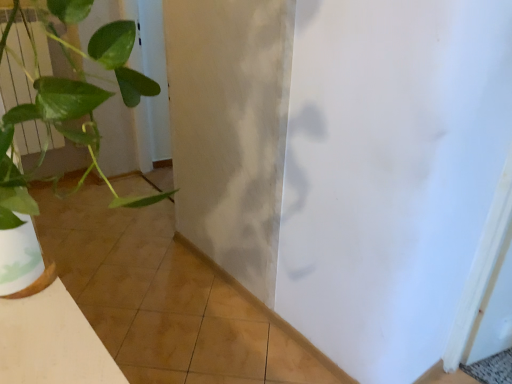
Where is `brown ceramic flowerpot at lower left`? The image size is (512, 384). brown ceramic flowerpot at lower left is located at coordinates (x=23, y=262).

Describe the element at coordinates (23, 262) in the screenshot. I see `brown ceramic flowerpot at lower left` at that location.

This screenshot has width=512, height=384. What are the coordinates of `brown ceramic flowerpot at lower left` in the screenshot? It's located at (23, 262).